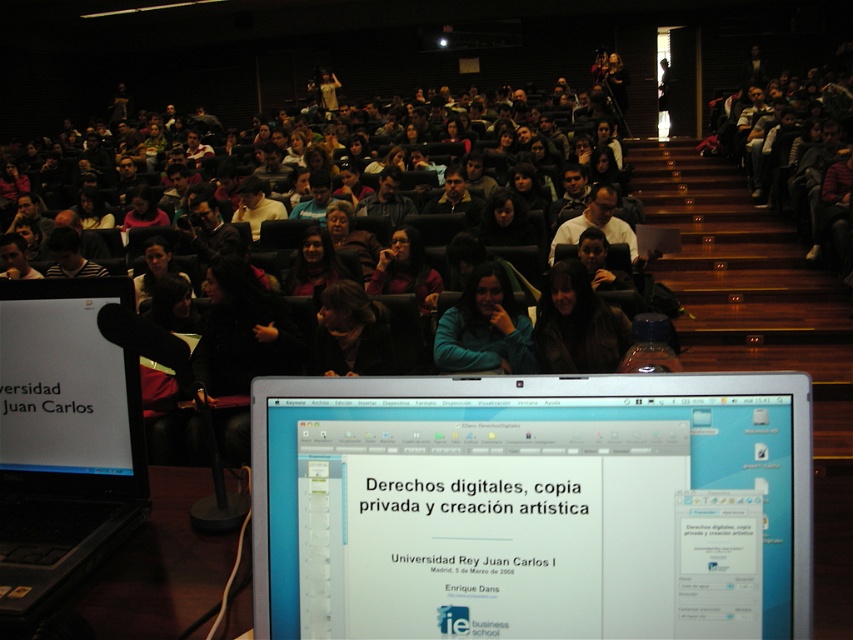
Question: Which point appears farthest from the camera in this image?

Choices:
 (A) (32, 419)
 (B) (782, 536)

Answer: (A)

Question: Which point appears closest to the camera in this image?

Choices:
 (A) (601, 588)
 (B) (508, 339)

Answer: (A)

Question: Can you confirm if silver metallic laptop at center is bigger than matte black hair at center?

Choices:
 (A) yes
 (B) no

Answer: (B)

Question: Which of the following is the farthest from the observer?

Choices:
 (A) teal fleece jacket at center
 (B) silver metallic laptop at center

Answer: (A)

Question: Does silver metallic laptop at center appear over teal fleece jacket at center?

Choices:
 (A) yes
 (B) no

Answer: (B)

Question: In this image, where is black matte laptop at left located relative to teal fleece jacket at center?

Choices:
 (A) left
 (B) right

Answer: (A)